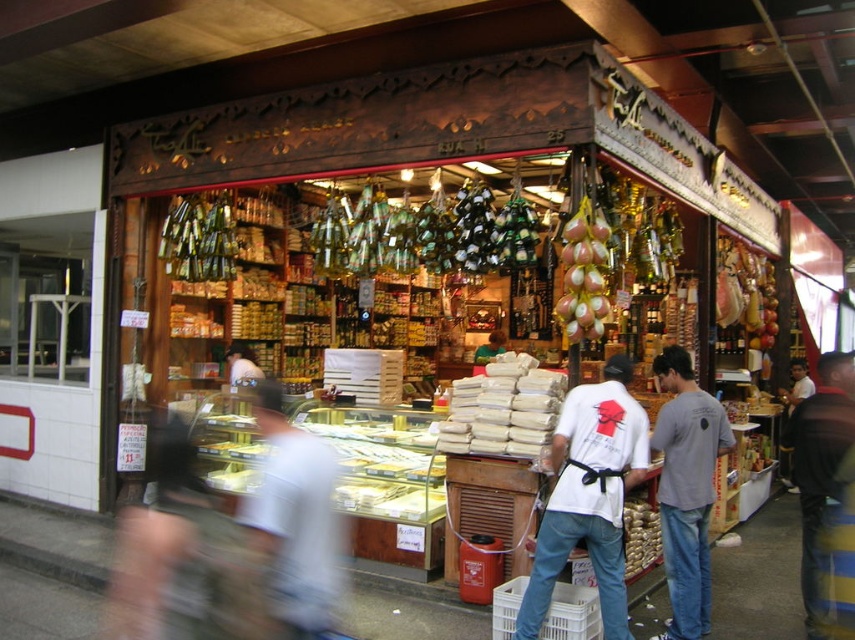
You are a customer at the market stall and want to buy both the white cotton shirt at center and the dark blue jeans at lower right. However, you have a limited budget and can only afford one item. Based on their positions in the stall, which item is more prominently displayed and likely to be a featured product?

The white cotton shirt at center is in front of the dark blue jeans at lower right, making it more prominently displayed and likely the featured product.